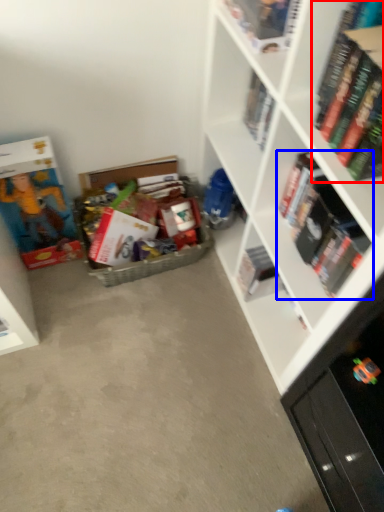
Question: Which object is closer to the camera taking this photo, book (highlighted by a red box) or book (highlighted by a blue box)?

Choices:
 (A) book
 (B) book

Answer: (A)